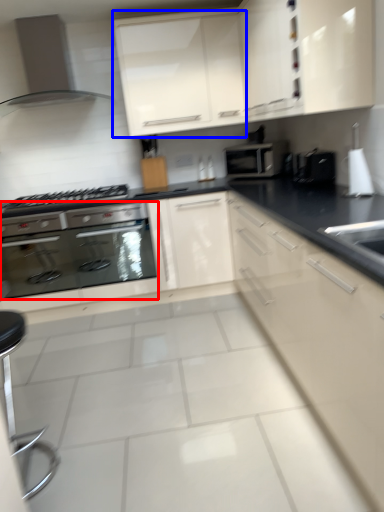
Question: Which object is closer to the camera taking this photo, oven (highlighted by a red box) or cabinetry (highlighted by a blue box)?

Choices:
 (A) oven
 (B) cabinetry

Answer: (B)